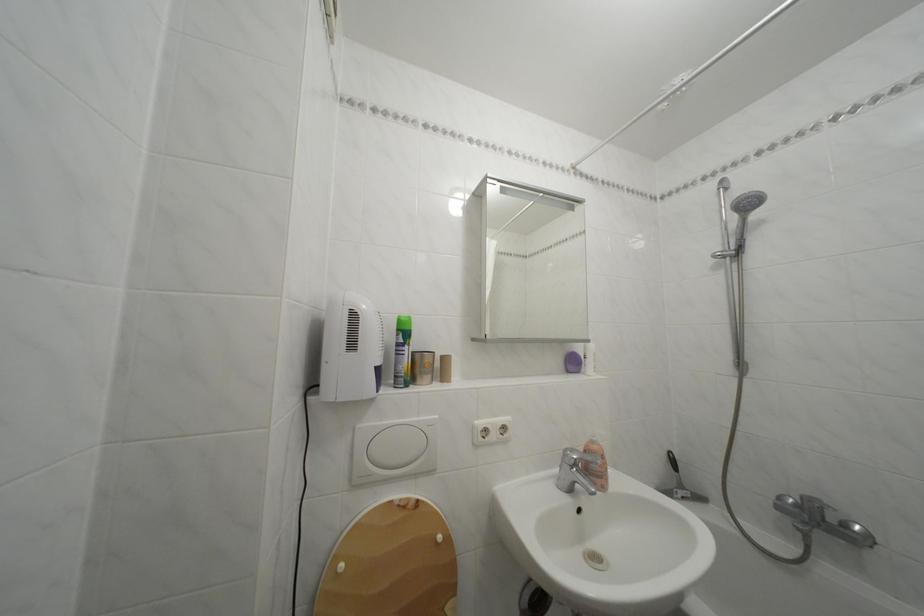
Find where to press the soap dispenser pump. Please return your answer as a coordinate pair (x, y).

(596, 464)